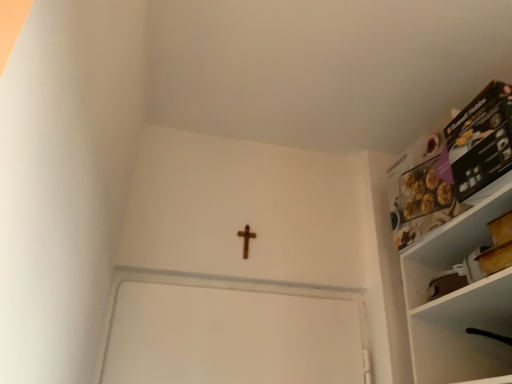
Find the location of a particular element. Image resolution: width=512 pixels, height=384 pixels. wooden cross at center is located at coordinates (246, 239).

In order to face wooden cross at center, should I rotate leftwards or rightwards?

You should look left and rotate roughly 1.368 degrees.

What do you see at coordinates (246, 239) in the screenshot?
I see `wooden cross at center` at bounding box center [246, 239].

At what (x,y) coordinates should I click in order to perform the action: click on wooden cross at center. Please return your answer as a coordinate pair (x, y). Looking at the image, I should click on (246, 239).